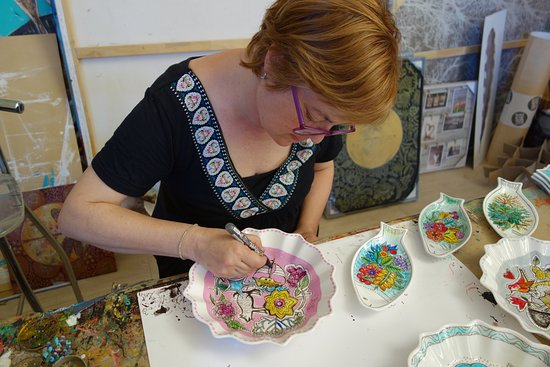
I want to click on picture frame, so click(x=444, y=114).